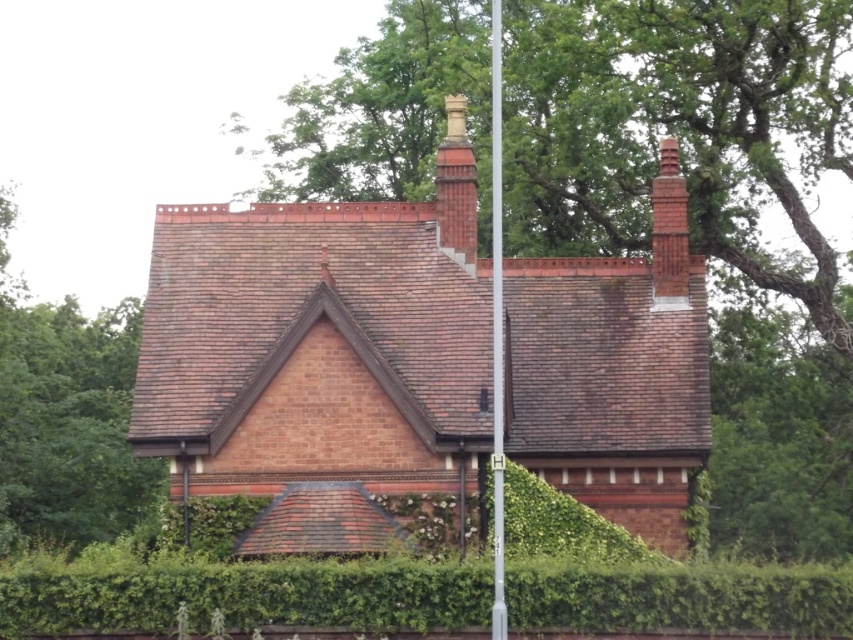
Is the position of green leafy hedge at lower center more distant than that of brown shingles at left?

That is False.

Who is positioned more to the right, green leafy hedge at lower center or brown shingles at left?

From the viewer's perspective, green leafy hedge at lower center appears more on the right side.

The height and width of the screenshot is (640, 853). What are the coordinates of `green leafy hedge at lower center` in the screenshot? It's located at (247, 595).

The image size is (853, 640). I want to click on green leafy hedge at lower center, so click(247, 595).

Does green leafy hedge at lower center have a greater width compared to red brick chimney at upper right?

Correct, the width of green leafy hedge at lower center exceeds that of red brick chimney at upper right.

Is point (830, 625) in front of point (653, 268)?

Yes.

Locate an element on the screen. Image resolution: width=853 pixels, height=640 pixels. green leafy hedge at lower center is located at coordinates (247, 595).

Can you confirm if green leafy tree at upper center is shorter than metallic silver flag pole at center?

Yes, green leafy tree at upper center is shorter than metallic silver flag pole at center.

Describe the element at coordinates (679, 129) in the screenshot. I see `green leafy tree at upper center` at that location.

Is point (732, 16) positioned after point (498, 582)?

Yes, it is.

Find the location of a particular element. green leafy tree at upper center is located at coordinates (679, 129).